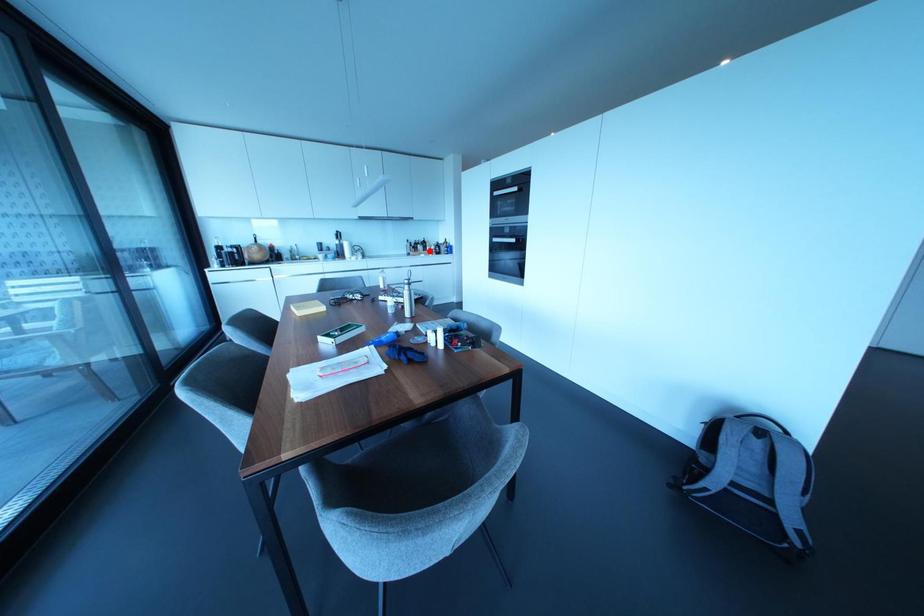
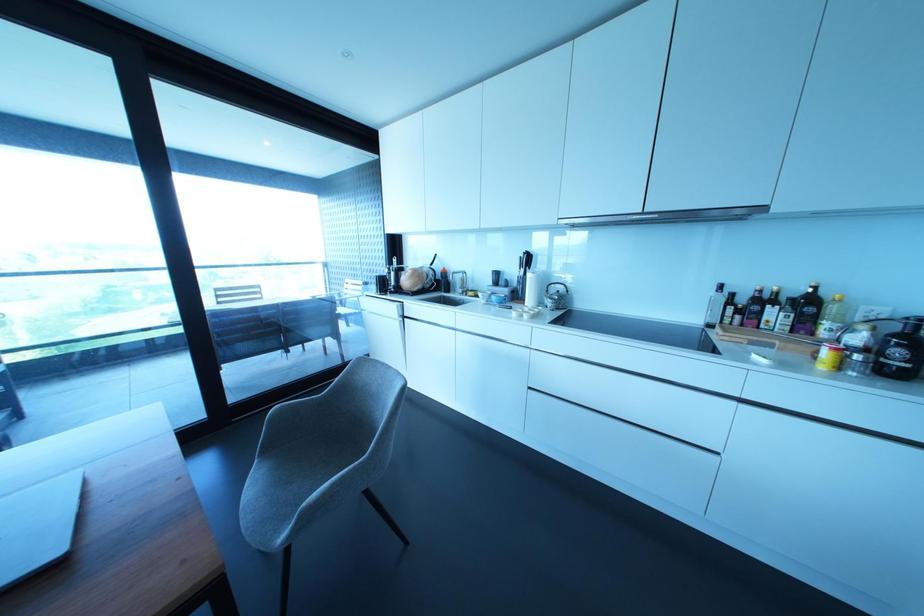
Where in the second image is the point corresponding to the highlighted location from the first image?

(825, 353)